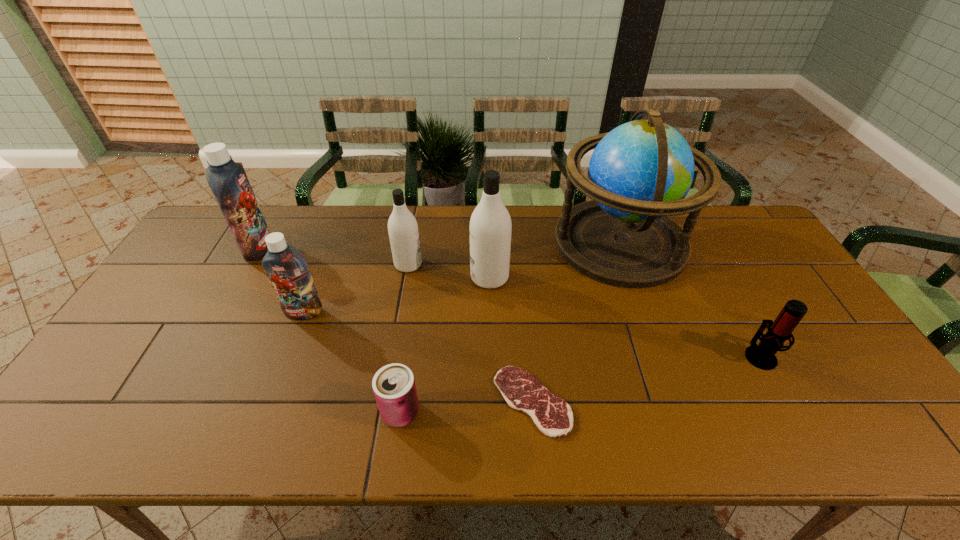
The width and height of the screenshot is (960, 540). Find the location of `the sixth tallest object`. the sixth tallest object is located at coordinates (762, 356).

This screenshot has width=960, height=540. In order to click on can in this screenshot , I will do `click(394, 387)`.

The image size is (960, 540). Find the location of `the seventh tallest object`. the seventh tallest object is located at coordinates (394, 387).

I want to click on the shortest object, so click(x=553, y=416).

Image resolution: width=960 pixels, height=540 pixels. Identify the location of red steak. (553, 416).

What are the coordinates of `vacant space located on the right of the globe` in the screenshot? It's located at (736, 242).

At what (x,y) coordinates should I click in order to perform the action: click on vacant region located 0.360m on the front label of the left blue shampoo. Please return your answer as a coordinate pair (x, y). Looking at the image, I should click on (381, 248).

The height and width of the screenshot is (540, 960). What are the coordinates of `vacant space located on the front-facing side of the bigger white shampoo` in the screenshot? It's located at point(395,278).

Locate an element on the screen. vacant area situated on the front-facing side of the bigger white shampoo is located at coordinates (424, 278).

I want to click on free region located on the front-facing side of the bigger white shampoo, so click(x=401, y=278).